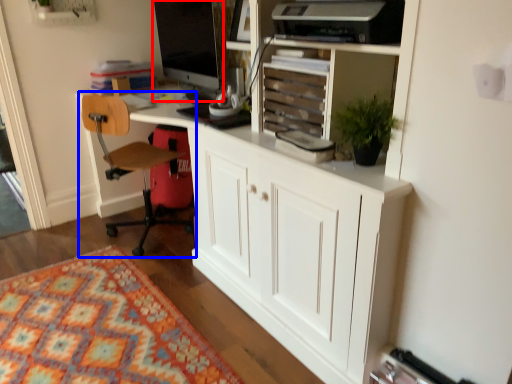
Question: Among these objects, which one is farthest to the camera, computer monitor (highlighted by a red box) or chair (highlighted by a blue box)?

Choices:
 (A) computer monitor
 (B) chair

Answer: (A)